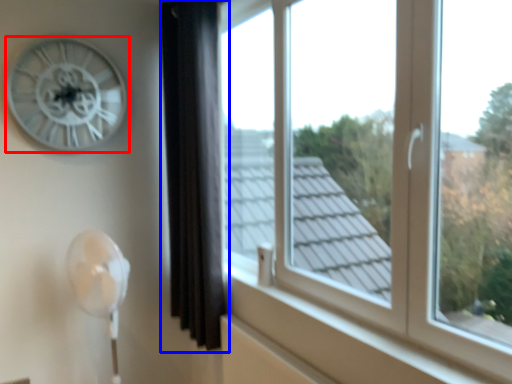
Question: Which object is closer to the camera taking this photo, wall clock (highlighted by a red box) or curtain (highlighted by a blue box)?

Choices:
 (A) wall clock
 (B) curtain

Answer: (B)